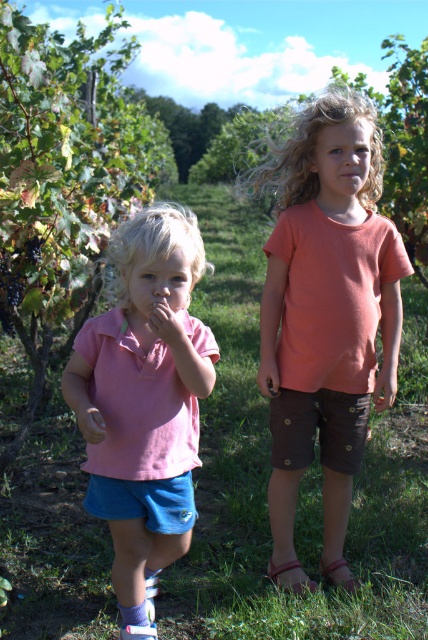
You are a photographer trying to capture the children in the vineyard. You notice a point at coordinates (326,316). Which child is this point located on?

The point at coordinates (326,316) is on the matte coral t shirt at center, so it is located on the child wearing the matte coral t shirt at center.